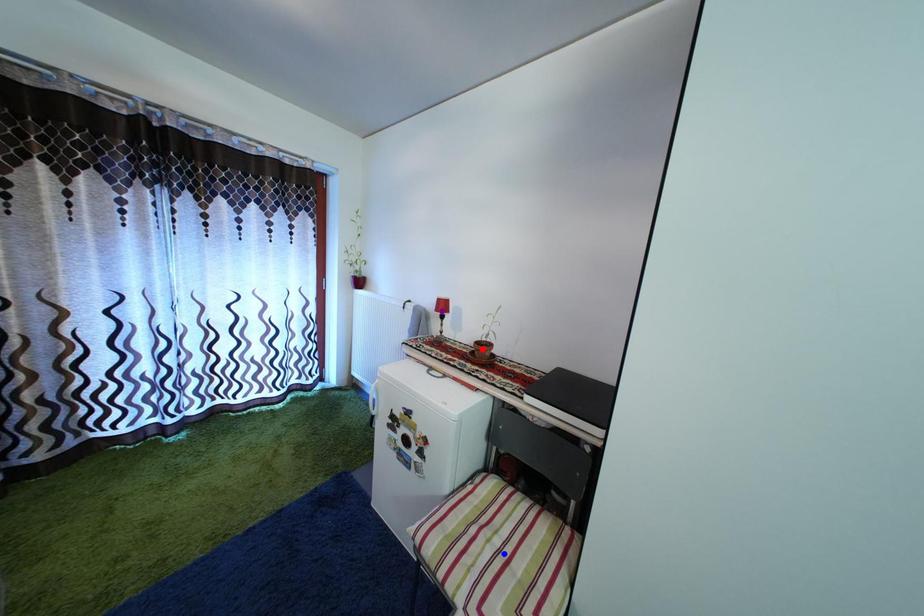
Order these from farthest to nearest:
A) purple point
B) blue point
C) red point

1. purple point
2. red point
3. blue point